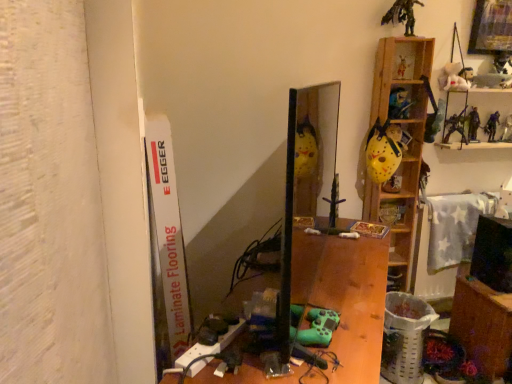
What do you see at coordinates (400, 146) in the screenshot? This screenshot has height=384, width=512. I see `wooden at right, acting as the third shelf starting from the top` at bounding box center [400, 146].

Measure the distance between point (253, 359) and camera.

They are 1.11 meters apart.

Where is `wooden table at lower right`? This screenshot has height=384, width=512. wooden table at lower right is located at coordinates (482, 323).

Is the depth of wooden shelf at upper right, the first shelf in the top-to-bottom sequence, greater than that of wooden at right, marked as the first shelf in a bottom-to-top arrangement?

Yes, wooden shelf at upper right, the first shelf in the top-to-bottom sequence, is further from the camera.

From the picture: Considering the sizes of objects wooden shelf at upper right, the first shelf in the top-to-bottom sequence, and wooden at right, marked as the first shelf in a bottom-to-top arrangement, in the image provided, who is smaller, wooden shelf at upper right, the first shelf in the top-to-bottom sequence, or wooden at right, marked as the first shelf in a bottom-to-top arrangement,?

wooden shelf at upper right, the first shelf in the top-to-bottom sequence, is smaller.

Considering the sizes of wooden shelf at upper right, the first shelf in the top-to-bottom sequence, and wooden at right, acting as the third shelf starting from the top, in the image, is wooden shelf at upper right, the first shelf in the top-to-bottom sequence, wider or thinner than wooden at right, acting as the third shelf starting from the top,?

In the image, wooden shelf at upper right, the first shelf in the top-to-bottom sequence, appears to be more narrow than wooden at right, acting as the third shelf starting from the top.

Is wooden shelf at upper right, the third shelf in the bottom-to-top sequence, positioned far away from wooden at right, marked as the first shelf in a bottom-to-top arrangement?

No, wooden shelf at upper right, the third shelf in the bottom-to-top sequence, is not far from wooden at right, marked as the first shelf in a bottom-to-top arrangement.

The width and height of the screenshot is (512, 384). In order to click on the 1st shelf behind the white laminate flooring at left in this screenshot , I will do `click(400, 146)`.

Is point (404, 199) less distant than point (169, 127)?

No, (404, 199) is further to viewer.

From the image's perspective, who appears lower, wooden at right, acting as the third shelf starting from the top, or white laminate flooring at left?

From the image's view, white laminate flooring at left is below.

Is white laminate flooring at left surrounded by wooden at right, marked as the first shelf in a bottom-to-top arrangement?

No, wooden at right, marked as the first shelf in a bottom-to-top arrangement, does not contain white laminate flooring at left.

From a real-world perspective, is wooden at right, marked as the first shelf in a bottom-to-top arrangement, over wooden shelf at upper right, the first shelf in the top-to-bottom sequence?

No, from a real-world perspective, wooden at right, marked as the first shelf in a bottom-to-top arrangement, is not over wooden shelf at upper right, the first shelf in the top-to-bottom sequence

Is wooden at right, marked as the first shelf in a bottom-to-top arrangement, facing towards wooden shelf at upper right, the third shelf in the bottom-to-top sequence?

Yes, wooden at right, marked as the first shelf in a bottom-to-top arrangement, is turned towards wooden shelf at upper right, the third shelf in the bottom-to-top sequence.

Is wooden at right, acting as the third shelf starting from the top, bigger than wooden shelf at upper right, the third shelf in the bottom-to-top sequence?

Yes.

Is wooden at right, marked as the first shelf in a bottom-to-top arrangement, completely or partially outside of wooden shelf at upper right, the first shelf in the top-to-bottom sequence?

Indeed, wooden at right, marked as the first shelf in a bottom-to-top arrangement, is completely outside wooden shelf at upper right, the first shelf in the top-to-bottom sequence.

Are yellow matte helmet at upper right, which is the second shelf in top-to-bottom order, and wooden at right, marked as the first shelf in a bottom-to-top arrangement, far apart?

No, yellow matte helmet at upper right, which is the second shelf in top-to-bottom order, is in close proximity to wooden at right, marked as the first shelf in a bottom-to-top arrangement.

From a real-world perspective, which object rests below the other?

In real-world perspective, wooden at right, acting as the third shelf starting from the top, is lower.

Between yellow matte helmet at upper right, which is the second shelf in top-to-bottom order, and wooden at right, acting as the third shelf starting from the top, which one has smaller size?

Smaller between the two is yellow matte helmet at upper right, which is the second shelf in top-to-bottom order.

Is wooden table at lower right inside the boundaries of yellow matte helmet at upper right, positioned as the second shelf in bottom-to-top order, or outside?

wooden table at lower right is not enclosed by yellow matte helmet at upper right, positioned as the second shelf in bottom-to-top order.

Which is in front, wooden table at lower right or yellow matte helmet at upper right, positioned as the second shelf in bottom-to-top order?

wooden table at lower right is closer to the camera.

Which point is more forward, (485,286) or (407,137)?

Point (485,286)

Measure the distance from wooden desk at center to wooden table at lower right.

wooden desk at center is 33.08 inches from wooden table at lower right.

From the image's perspective, is wooden desk at center above or below wooden table at lower right?

wooden desk at center is situated higher than wooden table at lower right in the image.

From a real-world perspective, is wooden desk at center located higher than wooden table at lower right?

Yes, from a real-world perspective, wooden desk at center is above wooden table at lower right.

Does wooden desk at center have a larger size compared to wooden table at lower right?

Indeed, wooden desk at center has a larger size compared to wooden table at lower right.

Which point is more forward, (408, 111) or (362, 331)?

The point (362, 331) is more forward.

Can you tell me how much wooden shelf at upper right, the third shelf in the bottom-to-top sequence, and wooden desk at center differ in facing direction?

There is a 58.3-degree angle between the facing directions of wooden shelf at upper right, the third shelf in the bottom-to-top sequence, and wooden desk at center.

Which of these two, wooden shelf at upper right, the first shelf in the top-to-bottom sequence, or wooden desk at center, is bigger?

Bigger between the two is wooden desk at center.

Considering the relative sizes of wooden shelf at upper right, the third shelf in the bottom-to-top sequence, and wooden desk at center in the image provided, is wooden shelf at upper right, the third shelf in the bottom-to-top sequence, wider than wooden desk at center?

No, wooden shelf at upper right, the third shelf in the bottom-to-top sequence, is not wider than wooden desk at center.

From the image's perspective, which shelf is the 2nd one above the wooden at right, marked as the first shelf in a bottom-to-top arrangement? Please provide its 2D coordinates.

[(400, 103)]

Locate an element on the screen. The image size is (512, 384). bulletin board to the left of wooden at right, acting as the third shelf starting from the top is located at coordinates (166, 246).

When comparing their distances from white laminate flooring at left, does wooden desk at center or wooden at right, acting as the third shelf starting from the top, seem further?

wooden at right, acting as the third shelf starting from the top, is positioned further to the anchor white laminate flooring at left.

Considering their positions, is wooden at right, marked as the first shelf in a bottom-to-top arrangement, positioned closer to wooden shelf at upper right, the first shelf in the top-to-bottom sequence, than wooden table at lower right?

wooden at right, marked as the first shelf in a bottom-to-top arrangement, is closer to wooden shelf at upper right, the first shelf in the top-to-bottom sequence.

From the image, which object appears to be nearer to wooden at right, acting as the third shelf starting from the top, wooden shelf at upper right, the third shelf in the bottom-to-top sequence, or wooden table at lower right?

wooden shelf at upper right, the third shelf in the bottom-to-top sequence, lies closer to wooden at right, acting as the third shelf starting from the top, than the other object.

When comparing their distances from wooden desk at center, does yellow matte helmet at upper right, which is the second shelf in top-to-bottom order, or wooden table at lower right seem closer?

wooden table at lower right is closer to wooden desk at center.

Estimate the real-world distances between objects in this image. Which object is closer to wooden shelf at upper right, the first shelf in the top-to-bottom sequence, white laminate flooring at left or wooden at right, marked as the first shelf in a bottom-to-top arrangement?

wooden at right, marked as the first shelf in a bottom-to-top arrangement.

Based on the photo, from the image, which object appears to be farther from yellow matte helmet at upper right, positioned as the second shelf in bottom-to-top order, wooden table at lower right or white laminate flooring at left?

white laminate flooring at left is further to yellow matte helmet at upper right, positioned as the second shelf in bottom-to-top order.

Estimate the real-world distances between objects in this image. Which object is closer to wooden desk at center, yellow matte helmet at upper right, positioned as the second shelf in bottom-to-top order, or white laminate flooring at left?

white laminate flooring at left.

Based on their spatial positions, is white laminate flooring at left or wooden table at lower right closer to wooden desk at center?

Based on the image, white laminate flooring at left appears to be nearer to wooden desk at center.

At what (x,y) coordinates should I click in order to perform the action: click on bulletin board between wooden desk at center and wooden at right, acting as the third shelf starting from the top, along the z-axis. Please return your answer as a coordinate pair (x, y). Looking at the image, I should click on (166, 246).

Identify the location of bulletin board located between wooden desk at center and wooden shelf at upper right, the third shelf in the bottom-to-top sequence, in the depth direction. (166, 246).

You are a GUI agent. You are given a task and a screenshot of the screen. Output one action in this format:
    pyautogui.click(x=<x>, y=<y>)
    Task: Click on the shelf between wooden desk at center and wooden shelf at upper right, the first shelf in the top-to-bottom sequence, along the z-axis
    This screenshot has width=512, height=384.
    Given the screenshot: What is the action you would take?
    pyautogui.click(x=400, y=146)

Find the location of a particular element. Image resolution: width=512 pixels, height=384 pixels. shelf between white laminate flooring at left and yellow matte helmet at upper right, positioned as the second shelf in bottom-to-top order, in the horizontal direction is located at coordinates (400, 146).